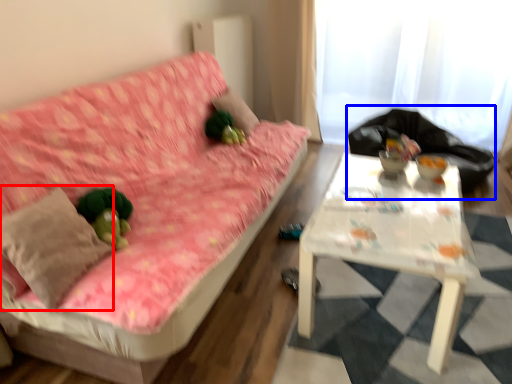
Question: Among these objects, which one is farthest to the camera, throw pillow (highlighted by a red box) or sit (highlighted by a blue box)?

Choices:
 (A) throw pillow
 (B) sit

Answer: (B)